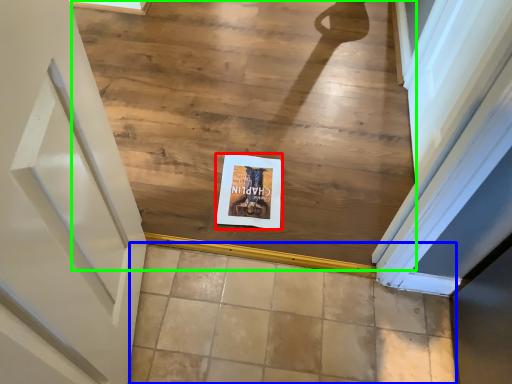
Question: Which object is positioned closest to postcard (highlighted by a red box)? Select from tile (highlighted by a blue box) and stairwell (highlighted by a green box).

Choices:
 (A) tile
 (B) stairwell

Answer: (A)